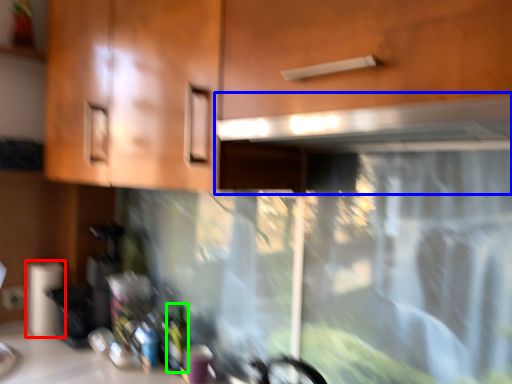
Question: Which is nearer to the paper towel (highlighted by a red box)? exhaust hood (highlighted by a blue box) or bottle (highlighted by a green box).

Choices:
 (A) exhaust hood
 (B) bottle

Answer: (B)